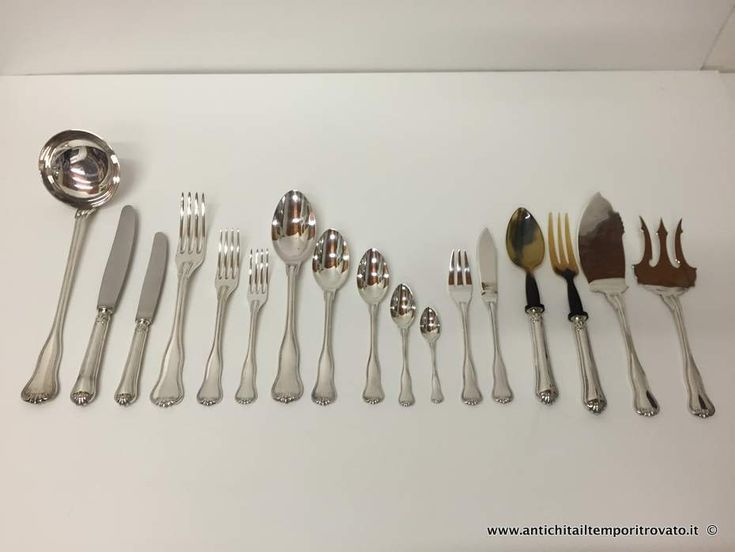
This screenshot has height=552, width=735. What are the coordinates of `spoons or ladles` in the screenshot? It's located at (293, 236), (328, 272), (376, 274), (401, 306), (429, 328), (528, 246), (82, 189).